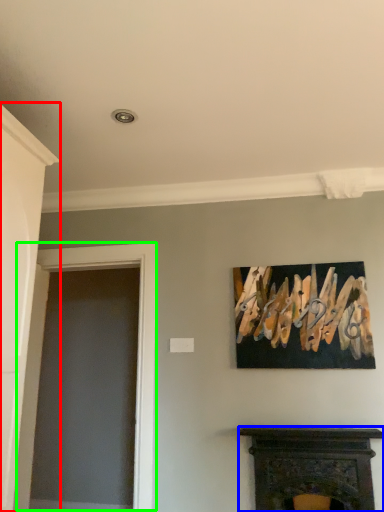
Question: Which object is the closest to the door (highlighted by a red box)? Choose among these: fireplace (highlighted by a blue box) or glass door (highlighted by a green box).

Choices:
 (A) fireplace
 (B) glass door

Answer: (B)